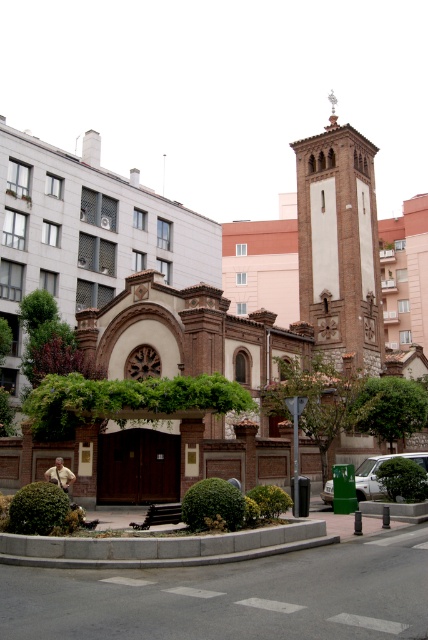
Question: Which of these objects is positioned closest to the green matte car at lower right?

Choices:
 (A) brown brick church at center
 (B) brick tower at upper right

Answer: (B)

Question: Which point is farther to the camera?

Choices:
 (A) (369, 492)
 (B) (335, 230)
 (C) (64, 244)

Answer: (C)

Question: Is brown brick church at center above green matte car at lower right?

Choices:
 (A) no
 (B) yes

Answer: (B)

Question: Which point is closer to the camera taking this photo?

Choices:
 (A) (315, 211)
 (B) (327, 288)

Answer: (B)

Question: Does brown brick church at center appear under green matte car at lower right?

Choices:
 (A) no
 (B) yes

Answer: (A)

Question: Is brown brick church at center wider than green matte car at lower right?

Choices:
 (A) no
 (B) yes

Answer: (B)